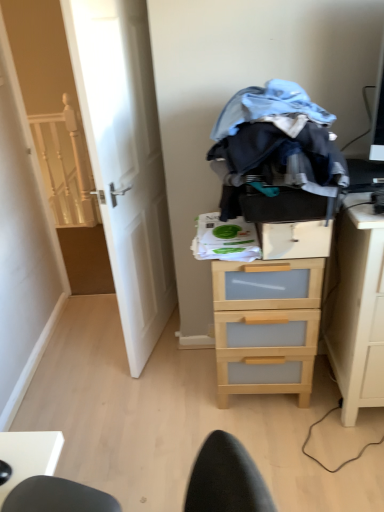
Locate an element on the screen. This screenshot has width=384, height=512. free space in front of white wooden door at left is located at coordinates (151, 397).